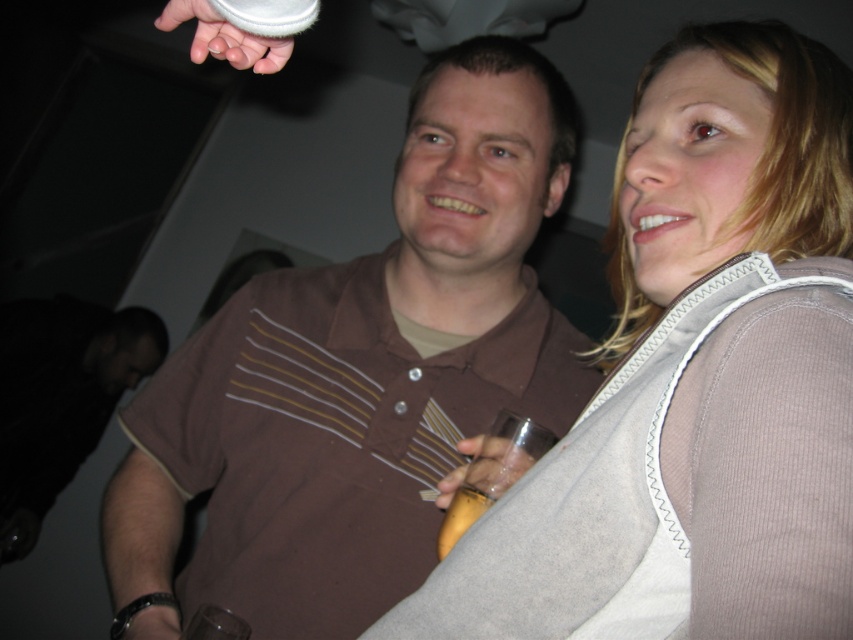
Question: Which of the following is the closest to the observer?

Choices:
 (A) (512, 486)
 (B) (444, 534)

Answer: (A)

Question: Is translucent glass at right thinner than yellow plastic cup at center?

Choices:
 (A) yes
 (B) no

Answer: (B)

Question: Does brown striped shirt at center lie behind translucent glass at right?

Choices:
 (A) yes
 (B) no

Answer: (A)

Question: Among these objects, which one is farthest from the camera?

Choices:
 (A) yellow plastic cup at center
 (B) translucent glass at right
 (C) suede vest at upper right

Answer: (B)

Question: Can you confirm if translucent glass at right is bigger than white fabric at upper left?

Choices:
 (A) no
 (B) yes

Answer: (A)

Question: Which of these objects is positioned closest to the brown striped shirt at center?

Choices:
 (A) translucent glass at right
 (B) yellow plastic cup at center
 (C) white fabric at upper left

Answer: (A)